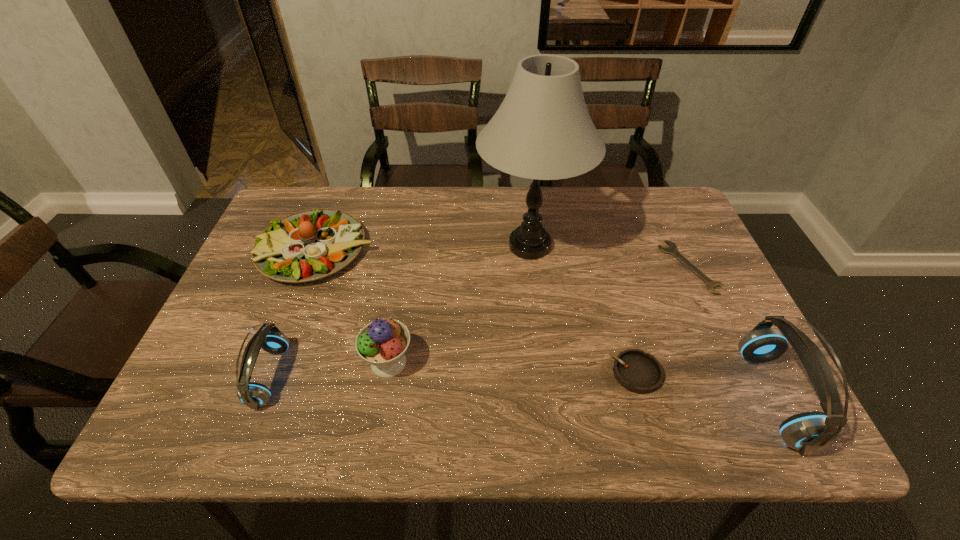
This screenshot has height=540, width=960. In order to click on free space between the sixth tallest object and the taller headset in this screenshot , I will do `click(704, 385)`.

Where is `free spot between the ashtray and the right headset`? The width and height of the screenshot is (960, 540). free spot between the ashtray and the right headset is located at coordinates (704, 385).

Choose which object is the nearest neighbor to the second tallest object. Please provide its 2D coordinates. Your answer should be formatted as a tuple, i.e. [(x, y)], where the tuple contains the x and y coordinates of a point satisfying the conditions above.

[(672, 249)]

Where is `object that is the closest to the second tallest object`? object that is the closest to the second tallest object is located at coordinates (672, 249).

This screenshot has width=960, height=540. Identify the location of vacant space that satisfies the following two spatial constraints: 1. on the front side of the fifth object from right to left; 2. on the ear cups of the shorter headset. (387, 376).